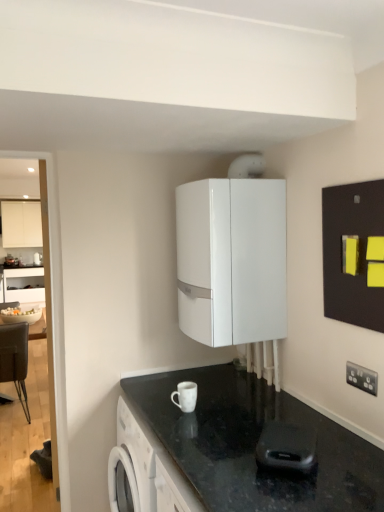
Question: From the image's perspective, relative to white glossy boiler at upper center, which is counted as the second appliance, starting from the right, is white glossy microwave at upper center above or below?

Choices:
 (A) below
 (B) above

Answer: (A)

Question: Is point (38, 252) closer or farther from the camera than point (256, 170)?

Choices:
 (A) closer
 (B) farther

Answer: (B)

Question: Based on their relative distances, which object is nearer to the white glossy boiler at center, the 1th cabinetry when ordered from front to back?

Choices:
 (A) black rubber remote control at lower center, placed as the third appliance when sorted from left to right
 (B) white glossy mug at lower center, the first appliance viewed from the left
 (C) matte white cabinet at upper left, which appears as the second cabinetry when ordered from the bottom
 (D) white glossy microwave at upper center
 (E) white plastic electric outlet at lower right

Answer: (B)

Question: Estimate the real-world distances between objects in this image. Which object is farther from the white glossy boiler at upper center, the 3th appliance in the front-to-back sequence?

Choices:
 (A) black rubber remote control at lower center, which ranks as the first appliance in bottom-to-top order
 (B) white glossy microwave at upper center
 (C) matte white cabinet at upper left, the first cabinetry from the left
 (D) white plastic electric outlet at lower right
 (E) brown leather chair at left

Answer: (C)